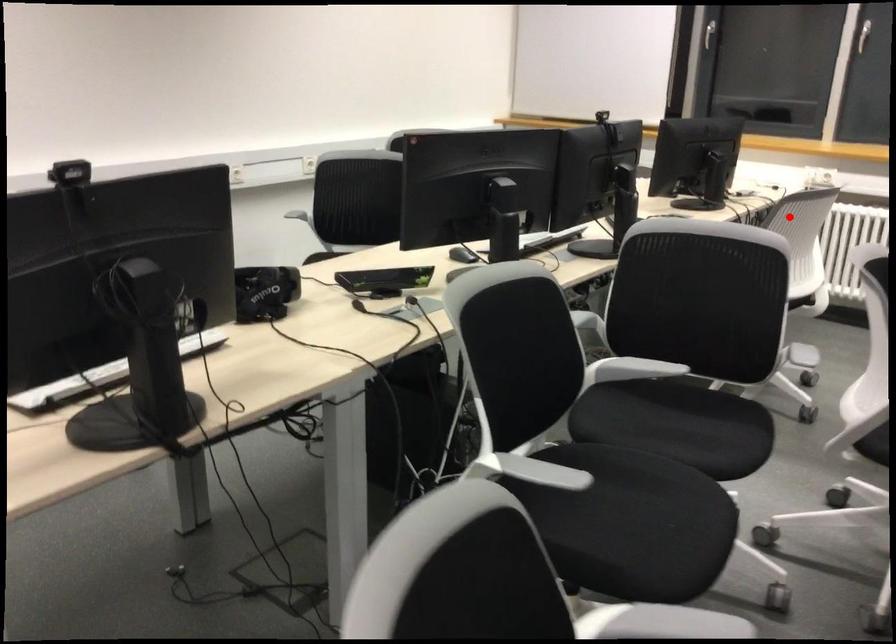
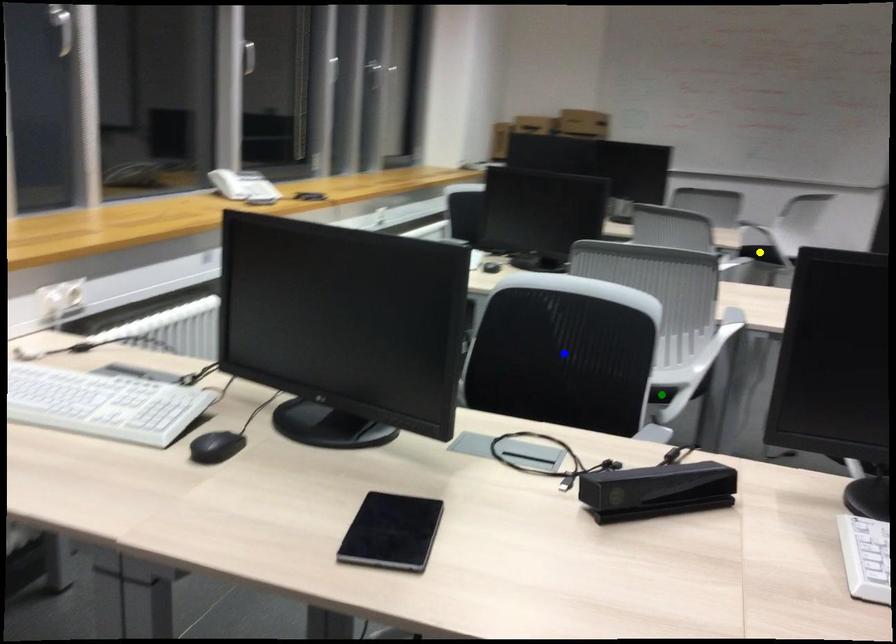
Question: I am providing you with two images of the same scene from different viewpoints. A red point is marked on the first image. You are given multiple points on the second image. Which spot in image 2 lines up with the point in image 1?

Choices:
 (A) blue point
 (B) yellow point
 (C) green point

Answer: (A)